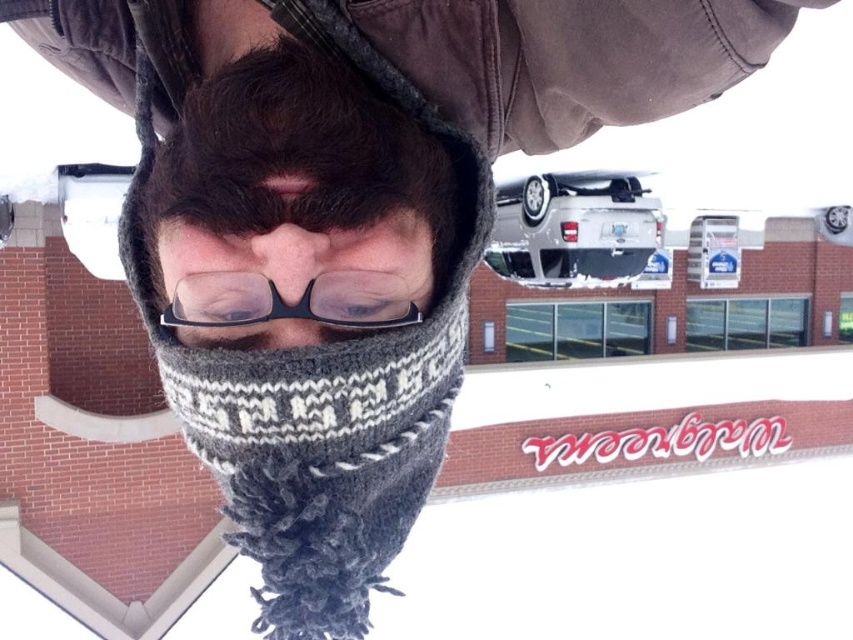
Between knitted wool scarf at center and black plastic glasses at center, which one appears on the right side from the viewer's perspective?

knitted wool scarf at center

What are the coordinates of `knitted wool scarf at center` in the screenshot? It's located at (308, 307).

Between knitted wool scarf at center and knitted gray scarf at center, which one is positioned higher?

Positioned higher is knitted gray scarf at center.

The width and height of the screenshot is (853, 640). In order to click on knitted wool scarf at center in this screenshot , I will do `click(308, 307)`.

Does knitted wool scarf at center appear under clear plastic glasses at center?

Yes.

Between knitted wool scarf at center and clear plastic glasses at center, which one is positioned lower?

Positioned lower is knitted wool scarf at center.

Where is `knitted wool scarf at center`? knitted wool scarf at center is located at coordinates (308, 307).